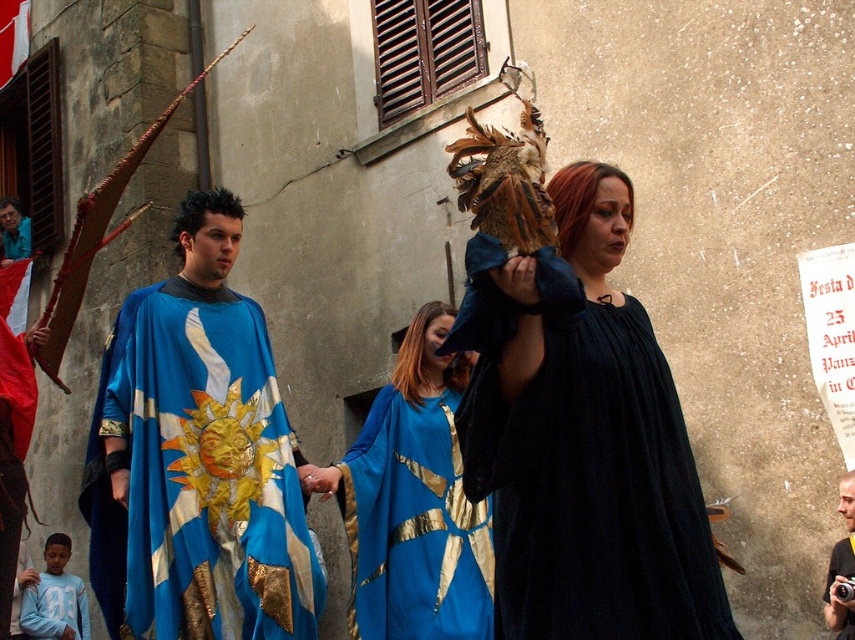
You are a photographer at the event and want to capture both the light blue cotton shirt at lower left and the shiny blue cape at center in a single frame. Which object should you focus on first to ensure both are in the shot?

The light blue cotton shirt at lower left is not as tall as the shiny blue cape at center, so you should focus on the shiny blue cape at center first to ensure both are in the shot.

Looking at this image, what is located at the coordinates point (204,451)?

The blue silk cape at center is located at point (204,451).

Based on the photo, you are a photographer trying to capture the best angle of the festival scene. You notice two points marked in the image at coordinates point (386, 504) and point (46, 588). Which point is closer to your camera lens?

Point (386, 504) is closer to the camera than point (46, 588).